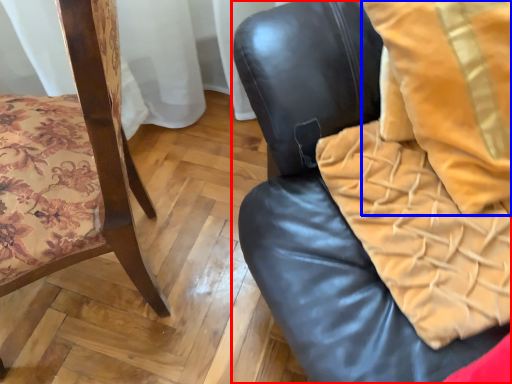
Question: Which object appears closest to the camera in this image, chair (highlighted by a red box) or throw pillow (highlighted by a blue box)?

Choices:
 (A) chair
 (B) throw pillow

Answer: (A)